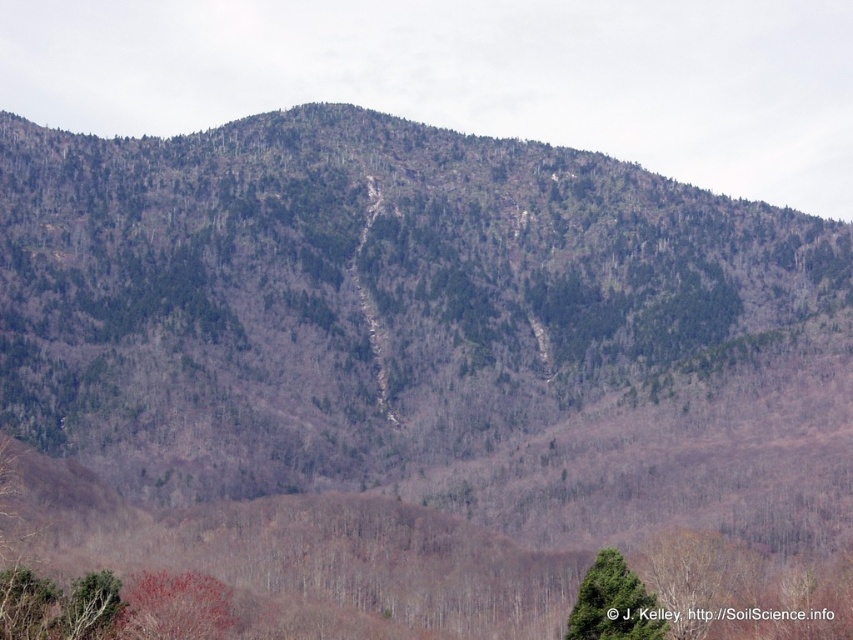
Can you confirm if smooth reddish-brown tree at lower left is positioned below green matte tree at lower right?

Yes, smooth reddish-brown tree at lower left is below green matte tree at lower right.

Who is higher up, smooth reddish-brown tree at lower left or green matte tree at lower right?

green matte tree at lower right is higher up.

Locate an element on the screen. smooth reddish-brown tree at lower left is located at coordinates (175, 605).

Identify the location of smooth reddish-brown tree at lower left. click(175, 605).